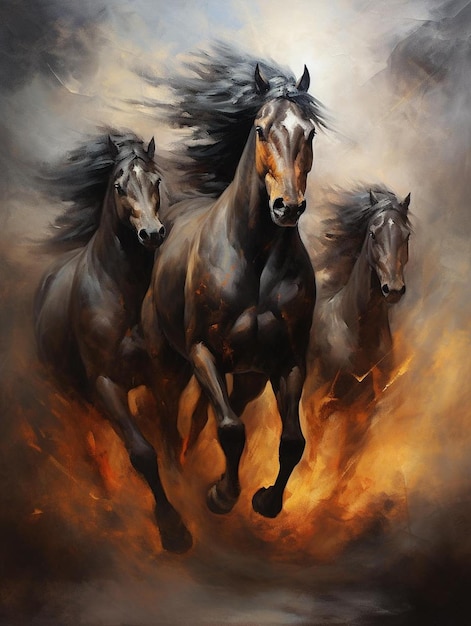
At what (x,y) coordinates should I click in order to perform the action: click on painting. Please return your answer as a coordinate pair (x, y). Looking at the image, I should click on (228, 568).